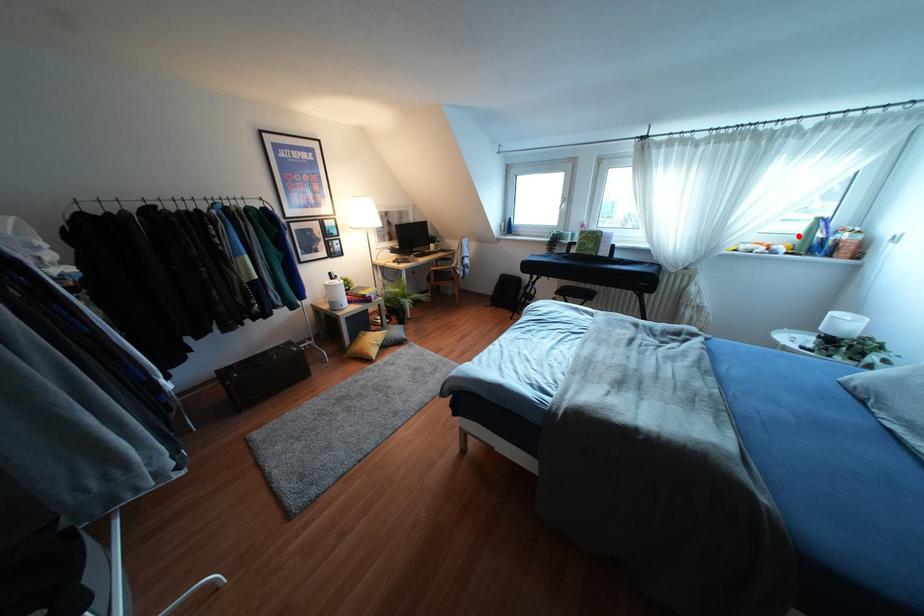
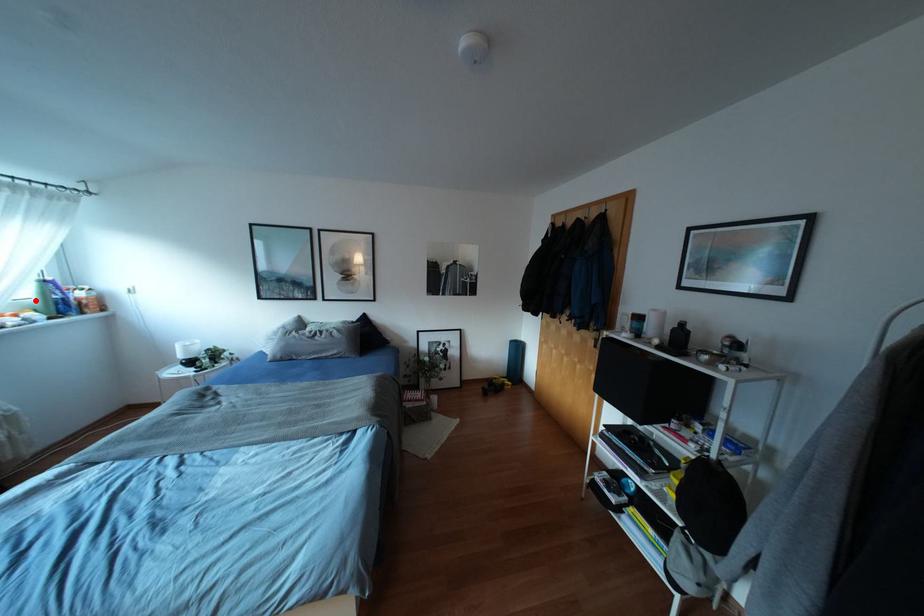
I am providing you with two images of the same scene from different viewpoints. A red point is marked on the first image and another point is marked on the second image. Are the points marked in image1 and image2 representing the same 3D position?

Yes